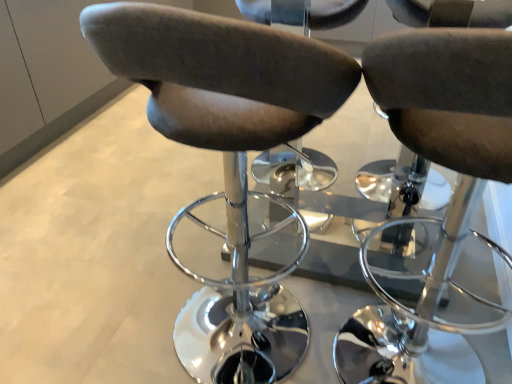
Question: Is suede-like brown chair at center, the second chair from the left, outside suede-like brown chair at center, acting as the first chair starting from the left?

Choices:
 (A) no
 (B) yes

Answer: (B)

Question: Is suede-like brown chair at center, the second chair from the left, closer to camera compared to suede-like brown chair at center, acting as the first chair starting from the left?

Choices:
 (A) yes
 (B) no

Answer: (A)

Question: Considering the relative positions of suede-like brown chair at center, the second chair from the left, and suede-like brown chair at center, the second chair in the right-to-left sequence, in the image provided, is suede-like brown chair at center, the second chair from the left, behind suede-like brown chair at center, the second chair in the right-to-left sequence,?

Choices:
 (A) no
 (B) yes

Answer: (A)

Question: Considering the relative sizes of suede-like brown chair at center, which is the 1th chair in right-to-left order, and suede-like brown chair at center, the second chair in the right-to-left sequence, in the image provided, is suede-like brown chair at center, which is the 1th chair in right-to-left order, wider than suede-like brown chair at center, the second chair in the right-to-left sequence,?

Choices:
 (A) yes
 (B) no

Answer: (A)

Question: From the image's perspective, is suede-like brown chair at center, which is the 1th chair in right-to-left order, located above suede-like brown chair at center, the second chair in the right-to-left sequence?

Choices:
 (A) no
 (B) yes

Answer: (A)

Question: Can you confirm if suede-like brown chair at center, which is the 1th chair in right-to-left order, is bigger than suede-like brown chair at center, the second chair in the right-to-left sequence?

Choices:
 (A) yes
 (B) no

Answer: (B)

Question: Does suede-like brown chair at center, the second chair in the right-to-left sequence, have a larger size compared to suede-like brown chair at center, which is the 1th chair in right-to-left order?

Choices:
 (A) no
 (B) yes

Answer: (B)

Question: Is suede-like brown chair at center, acting as the first chair starting from the left, wider than suede-like brown chair at center, the second chair from the left?

Choices:
 (A) no
 (B) yes

Answer: (A)

Question: Does suede-like brown chair at center, acting as the first chair starting from the left, turn towards suede-like brown chair at center, which is the 1th chair in right-to-left order?

Choices:
 (A) no
 (B) yes

Answer: (A)

Question: Considering the relative positions of suede-like brown chair at center, the second chair in the right-to-left sequence, and suede-like brown chair at center, the second chair from the left, in the image provided, is suede-like brown chair at center, the second chair in the right-to-left sequence, to the left of suede-like brown chair at center, the second chair from the left, from the viewer's perspective?

Choices:
 (A) no
 (B) yes

Answer: (B)

Question: Does suede-like brown chair at center, acting as the first chair starting from the left, have a greater height compared to suede-like brown chair at center, which is the 1th chair in right-to-left order?

Choices:
 (A) no
 (B) yes

Answer: (B)

Question: Does suede-like brown chair at center, acting as the first chair starting from the left, have a lesser height compared to suede-like brown chair at center, which is the 1th chair in right-to-left order?

Choices:
 (A) no
 (B) yes

Answer: (A)

Question: Is suede-like brown chair at center, acting as the first chair starting from the left, wider or thinner than suede-like brown chair at center, which is the 1th chair in right-to-left order?

Choices:
 (A) wide
 (B) thin

Answer: (B)